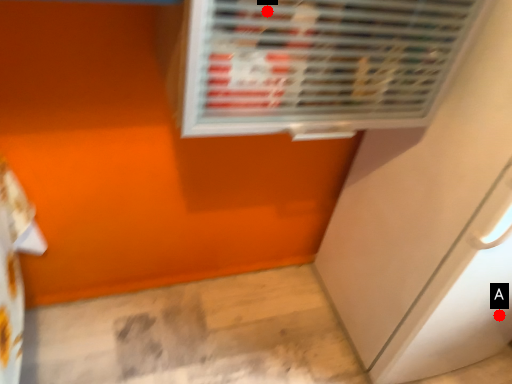
Question: Two points are circled on the image, labeled by A and B beside each circle. Which point is farther to the camera?

Choices:
 (A) A is further
 (B) B is further

Answer: (A)